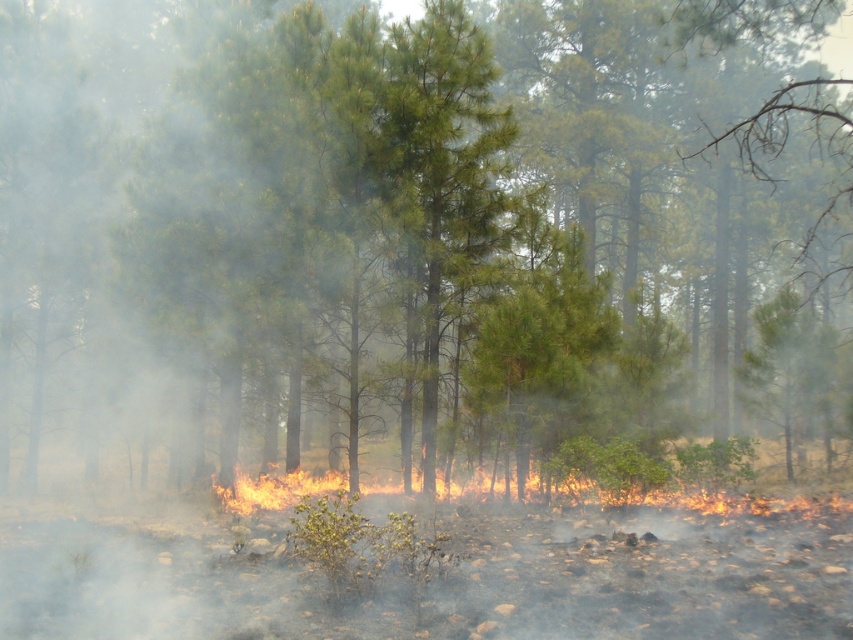
Question: Among these points, which one is farthest from the camera?

Choices:
 (A) (434, 116)
 (B) (474, 497)

Answer: (A)

Question: Is green textured pine tree at center positioned before flaming yellow-orange fire at center?

Choices:
 (A) no
 (B) yes

Answer: (A)

Question: Which point is farther from the camera taking this photo?

Choices:
 (A) (395, 132)
 (B) (380, 499)

Answer: (A)

Question: From the image, what is the correct spatial relationship of green textured pine tree at center in relation to flaming yellow-orange fire at center?

Choices:
 (A) right
 (B) left

Answer: (B)

Question: Can you confirm if green textured pine tree at center is positioned above flaming yellow-orange fire at center?

Choices:
 (A) yes
 (B) no

Answer: (A)

Question: Which point is farther to the camera?

Choices:
 (A) (633, 508)
 (B) (404, 486)

Answer: (B)